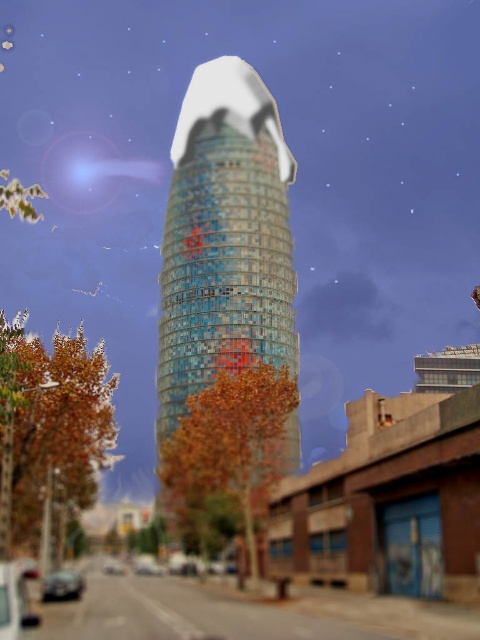
Is point (201, 300) in front of point (153, 573)?

Yes, it is in front of point (153, 573).

Between multicolored glass tower at center and shiny silver car at center, which one has less height?

shiny silver car at center is shorter.

Does point (225, 339) come closer to viewer compared to point (135, 572)?

Yes, it is.

Image resolution: width=480 pixels, height=640 pixels. What are the coordinates of `multicolored glass tower at center` in the screenshot? It's located at (225, 237).

Looking at this image, is multicolored glass tower at center shorter than shiny metallic car at lower left?

In fact, multicolored glass tower at center may be taller than shiny metallic car at lower left.

Measure the distance between multicolored glass tower at center and camera.

multicolored glass tower at center is 89.88 meters away from camera.

Where is `multicolored glass tower at center`? multicolored glass tower at center is located at coordinates (225, 237).

Is shiny metallic car at lower left taller than shiny silver car at lower left?

Yes.

This screenshot has height=640, width=480. What do you see at coordinates (62, 586) in the screenshot?
I see `shiny metallic car at lower left` at bounding box center [62, 586].

Is point (73, 573) more distant than point (110, 570)?

No, it is not.

At what (x,y) coordinates should I click in order to perform the action: click on shiny metallic car at lower left. Please return your answer as a coordinate pair (x, y). The image size is (480, 640). Looking at the image, I should click on (62, 586).